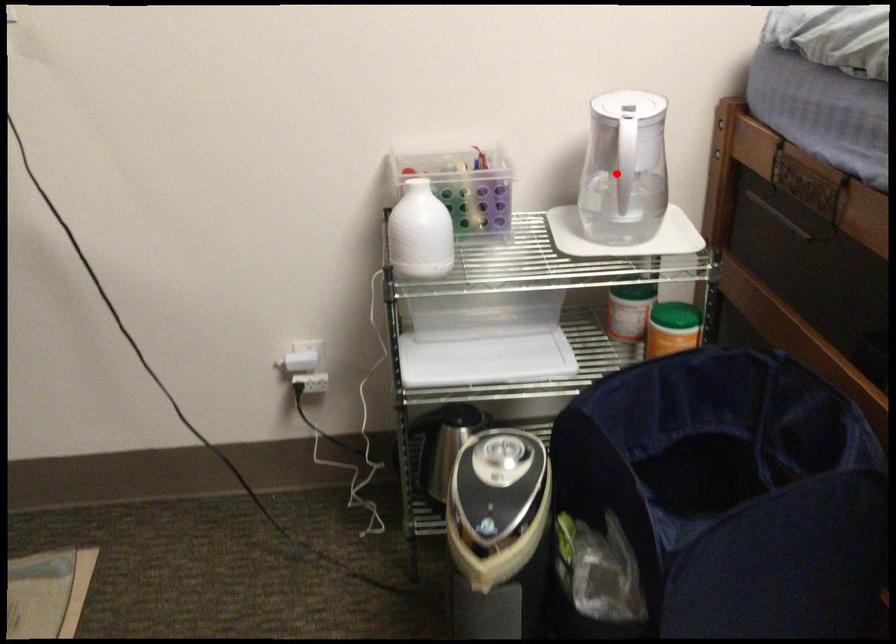
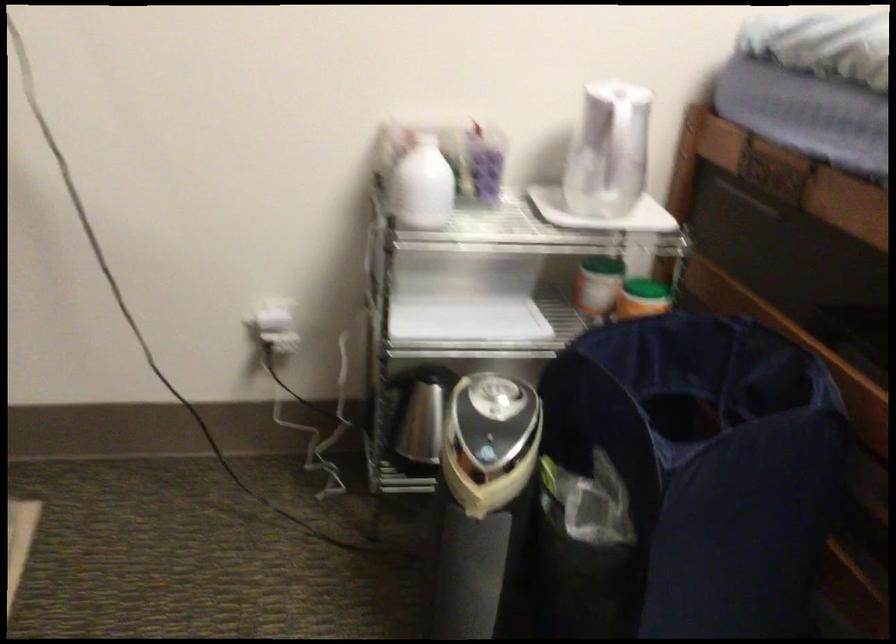
Question: I am providing you with two images of the same scene from different viewpoints. A red point is marked on the first image. Can you still see the location of the red point in image 2?

Choices:
 (A) Yes
 (B) No

Answer: (A)